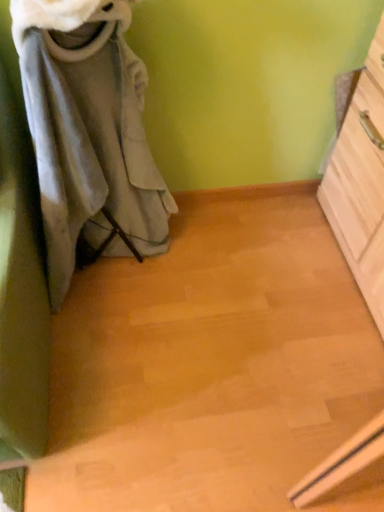
Question: Can you see light wood chest of drawers at right touching gray fabric laundry at left?

Choices:
 (A) yes
 (B) no

Answer: (B)

Question: Does light wood chest of drawers at right lie behind gray fabric laundry at left?

Choices:
 (A) no
 (B) yes

Answer: (B)

Question: Is light wood chest of drawers at right completely or partially outside of gray fabric laundry at left?

Choices:
 (A) no
 (B) yes

Answer: (B)

Question: Does light wood chest of drawers at right appear on the right side of gray fabric laundry at left?

Choices:
 (A) no
 (B) yes

Answer: (B)

Question: Is light wood chest of drawers at right wider than gray fabric laundry at left?

Choices:
 (A) yes
 (B) no

Answer: (B)

Question: Is gray fabric laundry at left located within light wood chest of drawers at right?

Choices:
 (A) no
 (B) yes

Answer: (A)

Question: Does gray fabric laundry at left have a larger size compared to light wood chest of drawers at right?

Choices:
 (A) yes
 (B) no

Answer: (B)

Question: Can we say gray fabric laundry at left lies outside light wood chest of drawers at right?

Choices:
 (A) no
 (B) yes

Answer: (B)

Question: Does gray fabric laundry at left appear on the left side of light wood chest of drawers at right?

Choices:
 (A) yes
 (B) no

Answer: (A)

Question: Is gray fabric laundry at left oriented towards light wood chest of drawers at right?

Choices:
 (A) yes
 (B) no

Answer: (B)

Question: Is light wood chest of drawers at right completely or partially inside gray fabric laundry at left?

Choices:
 (A) yes
 (B) no

Answer: (B)

Question: From the image's perspective, is gray fabric laundry at left above light wood chest of drawers at right?

Choices:
 (A) yes
 (B) no

Answer: (A)

Question: Is point (377, 79) closer or farther from the camera than point (61, 230)?

Choices:
 (A) farther
 (B) closer

Answer: (A)